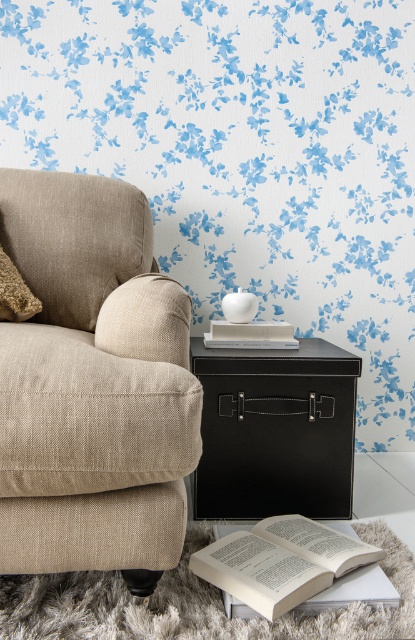
You are standing at the point marked as point [292,472] in the image. You want to place a 1.5 meter long sofa in this room. Can you fit it horizontally between the beige armchair and the black side table?

The distance between the beige armchair and the black side table is 1.70 meters. Since the sofa is 1.5 meters long, it can fit horizontally between them as there is enough space.

You are trying to place a rectangular photo frame on the surface of the black leather side table at center. Considering the presence of the fuzzy beige pillow at left, will the photo frame fit on the table?

The black leather side table at center might be wider than the fuzzy beige pillow at left, so there is a possibility that the photo frame could fit on the table. However, the exact dimensions of the photo frame and the available space on the table are unknown, so further measurements would be needed to confirm.

You are standing in the room shown in the image. There is a beige armchair against the wall with blue floral wallpaper and a black side table to its right. You notice a point marked at coordinates (92,385). What object is located at this point?

The point at coordinates (92,385) marks the beige fabric couch at left.